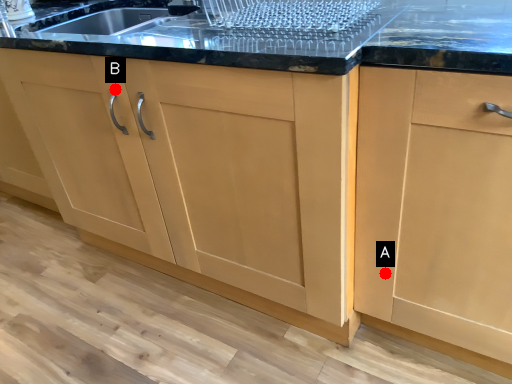
Question: Two points are circled on the image, labeled by A and B beside each circle. Which point is further to the camera?

Choices:
 (A) A is further
 (B) B is further

Answer: (B)